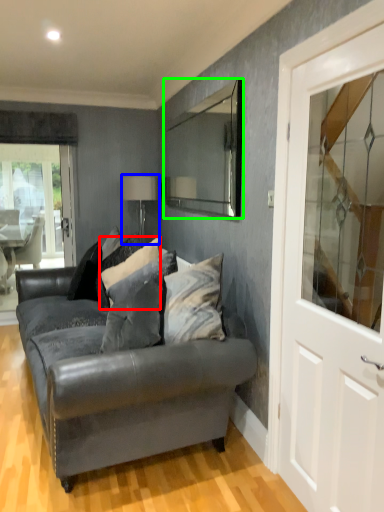
Question: Based on their relative distances, which object is nearer to pillow (highlighted by a red box)? Choose from lamp (highlighted by a blue box) and mirror (highlighted by a green box).

Choices:
 (A) lamp
 (B) mirror

Answer: (A)